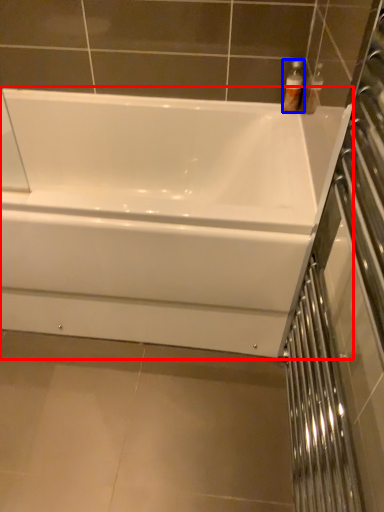
Question: Among these objects, which one is farthest to the camera, bathtub (highlighted by a red box) or toiletry (highlighted by a blue box)?

Choices:
 (A) bathtub
 (B) toiletry

Answer: (B)